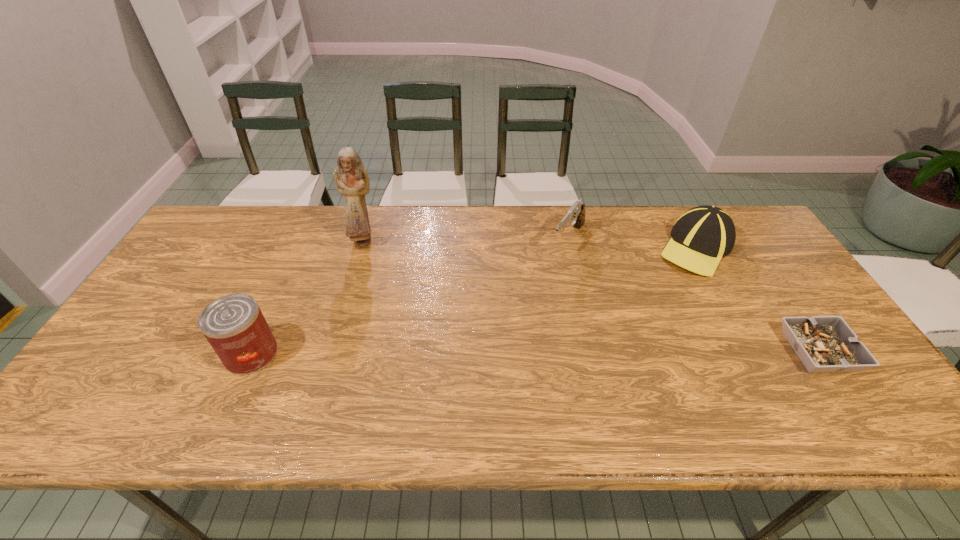
You are a GUI agent. You are given a task and a screenshot of the screen. Output one action in this format:
    pyautogui.click(x=<x>, y=<y>)
    Task: Click on the free spot between the baseball cap and the can
    
    Given the screenshot: What is the action you would take?
    pyautogui.click(x=474, y=301)

Find the location of a particular element. vacant space that is in between the can and the baseball cap is located at coordinates pyautogui.click(x=474, y=301).

Select which object appears as the fourth closest to the second object from left to right. Please provide its 2D coordinates. Your answer should be formatted as a tuple, i.e. [(x, y)], where the tuple contains the x and y coordinates of a point satisfying the conditions above.

[(824, 344)]

The width and height of the screenshot is (960, 540). Find the location of `object that is the fourth closest one to the figurine`. object that is the fourth closest one to the figurine is located at coordinates (824, 344).

Locate an element on the screen. The height and width of the screenshot is (540, 960). free space that satisfies the following two spatial constraints: 1. on the back side of the leftmost object; 2. on the left side of the ashtray is located at coordinates (252, 352).

Find the location of a particular element. This screenshot has height=540, width=960. vacant region that satisfies the following two spatial constraints: 1. on the front side of the baseball cap; 2. on the left side of the ashtray is located at coordinates (753, 352).